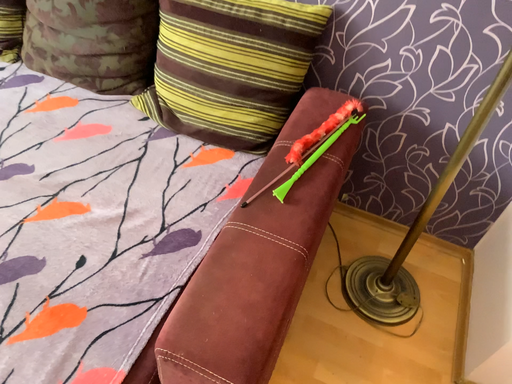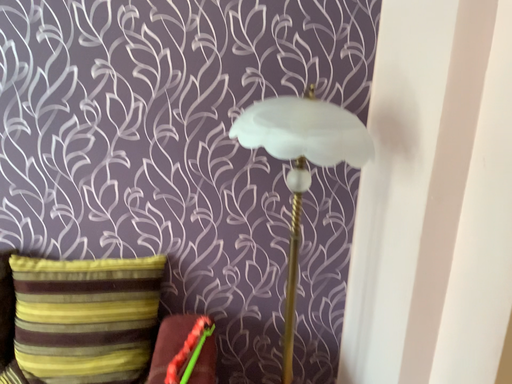
Question: Which way did the camera rotate in the video?

Choices:
 (A) rotated right
 (B) rotated left

Answer: (A)